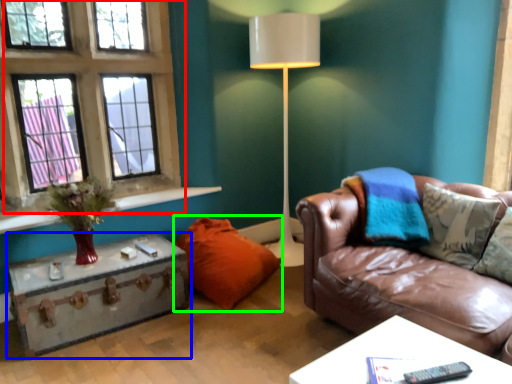
Question: Which is farther away from window (highlighted by a red box)? table (highlighted by a blue box) or pillow (highlighted by a green box)?

Choices:
 (A) table
 (B) pillow

Answer: (B)